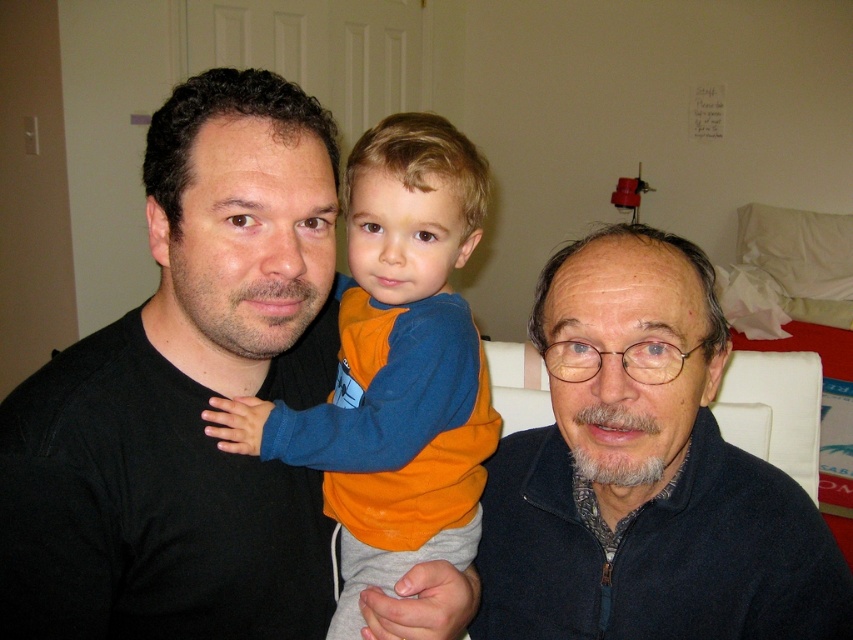
Is dark blue fleece at center further to the viewer compared to orange fleece at center?

No.

Does dark blue fleece at center appear under orange fleece at center?

Yes.

What do you see at coordinates (643, 472) in the screenshot? The width and height of the screenshot is (853, 640). I see `dark blue fleece at center` at bounding box center [643, 472].

You are a GUI agent. You are given a task and a screenshot of the screen. Output one action in this format:
    pyautogui.click(x=<x>, y=<y>)
    Task: Click on the dark blue fleece at center
    
    Given the screenshot: What is the action you would take?
    pyautogui.click(x=643, y=472)